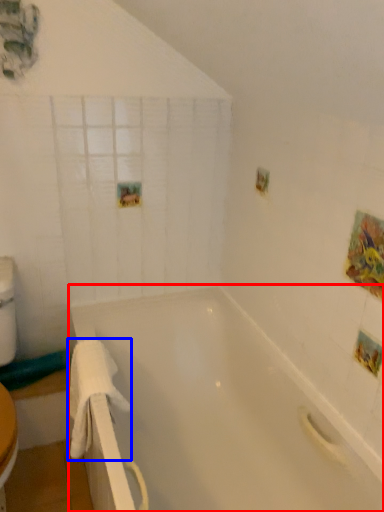
Question: Among these objects, which one is farthest to the camera, bathtub (highlighted by a red box) or towel/napkin (highlighted by a blue box)?

Choices:
 (A) bathtub
 (B) towel/napkin

Answer: (B)